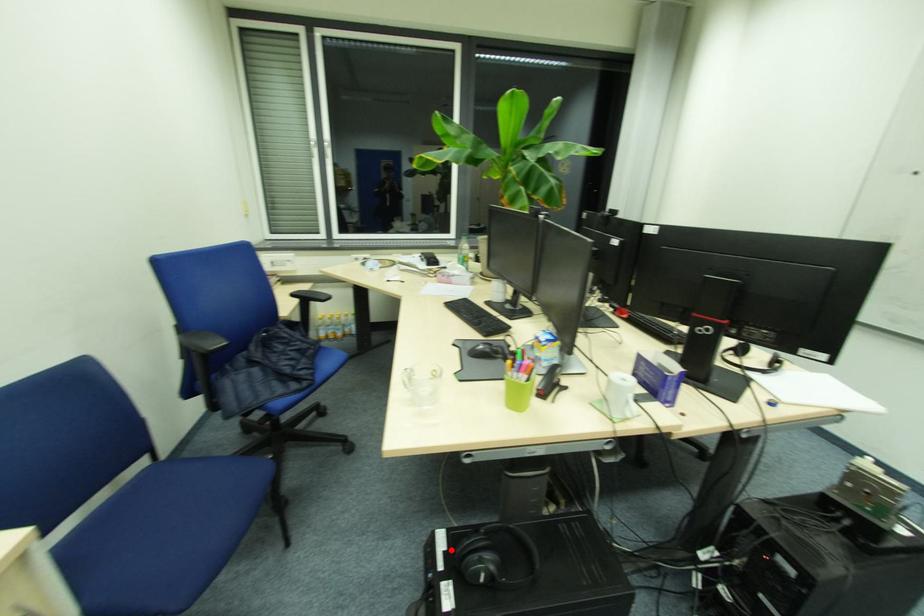
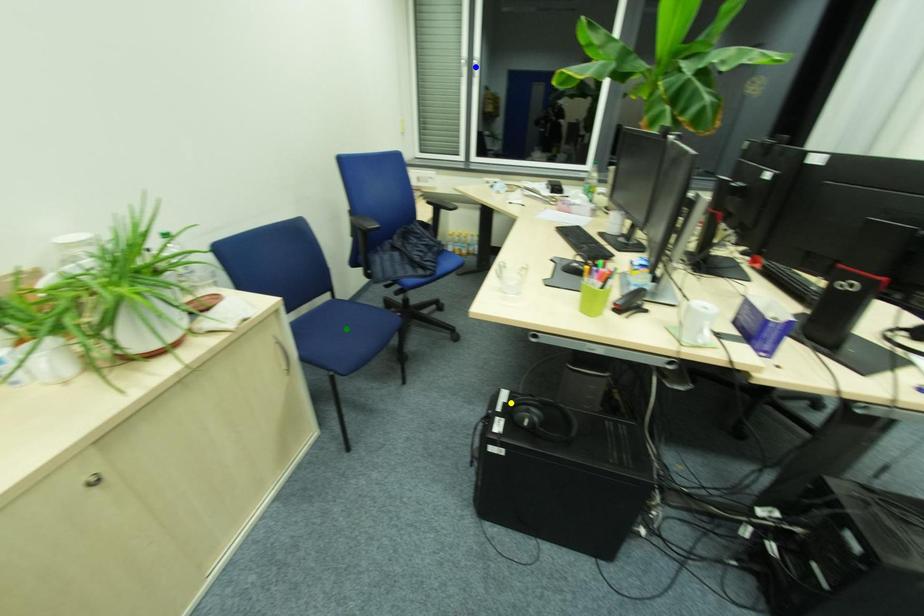
Question: I am providing you with two images of the same scene from different viewpoints. A red point is marked on the first image. You are given multiple points on the second image. Which point in image 2 represents the same 3d spot as the red point in image 1?

Choices:
 (A) green point
 (B) blue point
 (C) yellow point

Answer: (C)